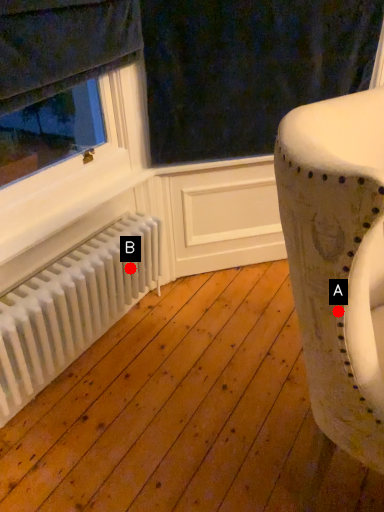
Question: Two points are circled on the image, labeled by A and B beside each circle. Which point appears farthest from the camera in this image?

Choices:
 (A) A is further
 (B) B is further

Answer: (B)